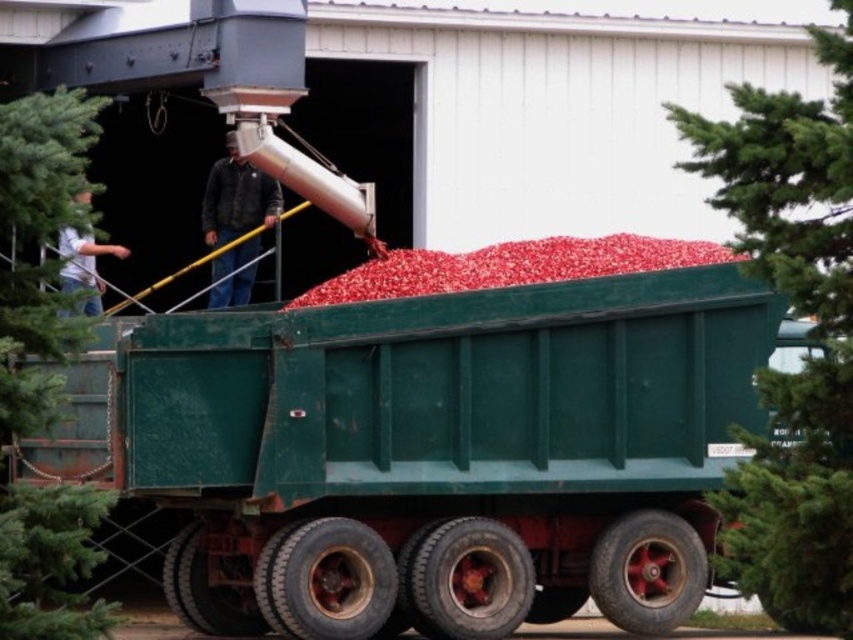
Question: Which point appears farthest from the camera in this image?

Choices:
 (A) (679, 572)
 (B) (799, 204)

Answer: (A)

Question: Does green textured tree at lower right have a smaller size compared to dark brown leather jacket at center?

Choices:
 (A) no
 (B) yes

Answer: (A)

Question: In this image, where is green matte truck at center located relative to green textured tree at lower right?

Choices:
 (A) below
 (B) above

Answer: (A)

Question: Which object is the farthest from the dark brown leather jacket at center?

Choices:
 (A) green textured tree at lower right
 (B) green textured tree at left

Answer: (A)

Question: In this image, where is green textured tree at lower right located relative to dark brown leather jacket at center?

Choices:
 (A) left
 (B) right

Answer: (B)

Question: Among these objects, which one is nearest to the camera?

Choices:
 (A) green textured tree at lower right
 (B) green textured tree at left
 (C) dark brown leather jacket at center

Answer: (A)